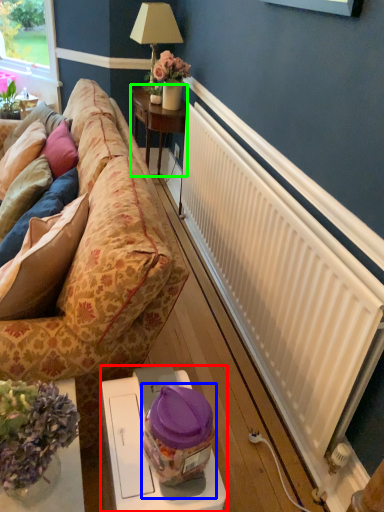
Question: Considering the real-world distances, which object is closest to table (highlighted by a red box)? food (highlighted by a blue box) or table (highlighted by a green box).

Choices:
 (A) food
 (B) table

Answer: (A)